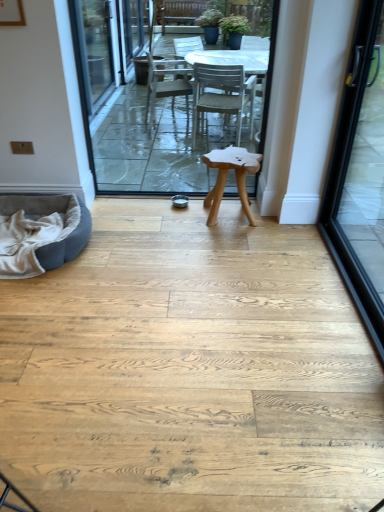
Question: Is gray suede bean bag at lower left inside natural wood stool at center?

Choices:
 (A) no
 (B) yes

Answer: (A)

Question: Is natural wood stool at center at the left side of gray suede bean bag at lower left?

Choices:
 (A) no
 (B) yes

Answer: (A)

Question: Is natural wood stool at center shorter than gray suede bean bag at lower left?

Choices:
 (A) yes
 (B) no

Answer: (B)

Question: From a real-world perspective, does natural wood stool at center stand above gray suede bean bag at lower left?

Choices:
 (A) no
 (B) yes

Answer: (B)

Question: Can we say natural wood stool at center lies outside gray suede bean bag at lower left?

Choices:
 (A) yes
 (B) no

Answer: (A)

Question: Is gray suede bean bag at lower left to the left or to the right of black glass door at right in the image?

Choices:
 (A) right
 (B) left

Answer: (B)

Question: Considering the positions of gray suede bean bag at lower left and black glass door at right in the image, is gray suede bean bag at lower left wider or thinner than black glass door at right?

Choices:
 (A) wide
 (B) thin

Answer: (A)

Question: From the image's perspective, is gray suede bean bag at lower left positioned above or below black glass door at right?

Choices:
 (A) below
 (B) above

Answer: (A)

Question: Looking at the image, does gray suede bean bag at lower left seem bigger or smaller compared to black glass door at right?

Choices:
 (A) small
 (B) big

Answer: (A)

Question: From the image's perspective, is black glass door at right located above or below natural wood stool at center?

Choices:
 (A) below
 (B) above

Answer: (A)

Question: Considering the relative positions of black glass door at right and natural wood stool at center in the image provided, is black glass door at right to the left or to the right of natural wood stool at center?

Choices:
 (A) right
 (B) left

Answer: (A)

Question: Is black glass door at right spatially inside natural wood stool at center, or outside of it?

Choices:
 (A) inside
 (B) outside

Answer: (B)

Question: Does point (377, 113) appear closer or farther from the camera than point (221, 183)?

Choices:
 (A) farther
 (B) closer

Answer: (B)

Question: From the image's perspective, is white plastic table at center above or below black glass door at right?

Choices:
 (A) below
 (B) above

Answer: (B)

Question: Do you think white plastic table at center is within black glass door at right, or outside of it?

Choices:
 (A) inside
 (B) outside

Answer: (B)